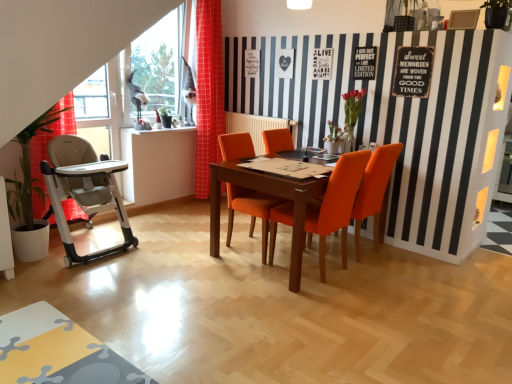
Describe the element at coordinates (52, 136) in the screenshot. I see `green leafy plant at left` at that location.

What is the approximate width of transparent glass window at upper left?

The width of transparent glass window at upper left is 8.88 inches.

How much space does orange fabric chair at center, which ranks as the first chair in right-to-left order, occupy vertically?

orange fabric chair at center, which ranks as the first chair in right-to-left order, is 38.79 inches tall.

What is the approximate width of orange fabric chair at center, which ranks as the 2th chair in right-to-left order?

orange fabric chair at center, which ranks as the 2th chair in right-to-left order, is 61.45 centimeters in width.

Where is `orange fabric chair at center, the 3th chair positioned from the right`? The width and height of the screenshot is (512, 384). orange fabric chair at center, the 3th chair positioned from the right is located at coordinates (251, 210).

The width and height of the screenshot is (512, 384). In order to click on green leafy plant at left in this screenshot , I will do `click(52, 136)`.

Can you confirm if red checkered curtain at left is positioned to the right of transparent glass window at upper left?

Yes, red checkered curtain at left is to the right of transparent glass window at upper left.

Considering the points (220, 105) and (139, 70), which point is in front, point (220, 105) or point (139, 70)?

The point (139, 70) is in front.

Which of these two, red checkered curtain at left or transparent glass window at upper left, is wider?

red checkered curtain at left.

From the image's perspective, is transparent glass window at upper left positioned above or below orange fabric chair at center, the 3th chair positioned from the right?

From the image's perspective, transparent glass window at upper left appears above orange fabric chair at center, the 3th chair positioned from the right.

Does transparent glass window at upper left have a greater width compared to orange fabric chair at center, the first chair in the left-to-right sequence?

No.

Where is `chair that is the 1st object located below the transparent glass window at upper left (from the image's perspective)`? This screenshot has width=512, height=384. chair that is the 1st object located below the transparent glass window at upper left (from the image's perspective) is located at coordinates (251, 210).

Can you confirm if transparent glass window at upper left is bigger than orange fabric chair at center, the 3th chair positioned from the right?

Actually, transparent glass window at upper left might be smaller than orange fabric chair at center, the 3th chair positioned from the right.

Measure the distance from red checkered curtain at left to orange fabric chair at center, which ranks as the 2th chair in right-to-left order.

6.10 feet.

Based on the photo, is red checkered curtain at left bigger than orange fabric chair at center, which ranks as the 2th chair in right-to-left order?

Incorrect, red checkered curtain at left is not larger than orange fabric chair at center, which ranks as the 2th chair in right-to-left order.

Are red checkered curtain at left and orange fabric chair at center, which ranks as the 2th chair in right-to-left order, beside each other?

red checkered curtain at left is not next to orange fabric chair at center, which ranks as the 2th chair in right-to-left order, and they're not touching.

From the picture: From a real-world perspective, is red checkered curtain at left above or below orange fabric chair at center, the second chair viewed from the left?

From a real-world perspective, red checkered curtain at left is physically above orange fabric chair at center, the second chair viewed from the left.

Considering the sizes of objects orange fabric chair at center, the 3th chair positioned from the left, and red checkered curtain at left in the image provided, who is bigger, orange fabric chair at center, the 3th chair positioned from the left, or red checkered curtain at left?

orange fabric chair at center, the 3th chair positioned from the left, is bigger.

Is orange fabric chair at center, the 3th chair positioned from the left, located outside red checkered curtain at left?

Absolutely, orange fabric chair at center, the 3th chair positioned from the left, is external to red checkered curtain at left.

Considering the positions of objects orange fabric chair at center, which ranks as the first chair in right-to-left order, and red checkered curtain at left in the image provided, who is behind, orange fabric chair at center, which ranks as the first chair in right-to-left order, or red checkered curtain at left?

red checkered curtain at left is behind.

Is red checkered curtain at left far from green leafy plant at left?

Absolutely, red checkered curtain at left is distant from green leafy plant at left.

From the image's perspective, between red checkered curtain at left and green leafy plant at left, which one is located above?

red checkered curtain at left, from the image's perspective.

Which of these two, red checkered curtain at left or green leafy plant at left, stands taller?

red checkered curtain at left is taller.

At what (x,y) coordinates should I click in order to perform the action: click on curtain lying behind the green leafy plant at left. Please return your answer as a coordinate pair (x, y). The width and height of the screenshot is (512, 384). Looking at the image, I should click on (208, 92).

Find the location of a particular element. curtain above the orange fabric chair at center, which ranks as the first chair in right-to-left order (from a real-world perspective) is located at coordinates (208, 92).

From a real-world perspective, is red checkered curtain at left on top of orange fabric chair at center, the 3th chair positioned from the left?

Yes, from a real-world perspective, red checkered curtain at left is above orange fabric chair at center, the 3th chair positioned from the left.

How distant is red checkered curtain at left from orange fabric chair at center, the 3th chair positioned from the left?

2.02 meters.

From the image's perspective, is red checkered curtain at left over orange fabric chair at center, which ranks as the first chair in right-to-left order?

Yes.

Is red checkered curtain at left a part of green leafy plant at left?

No, green leafy plant at left does not contain red checkered curtain at left.

From the picture: Is green leafy plant at left shorter than red checkered curtain at left?

Yes.

Considering the relative sizes of green leafy plant at left and red checkered curtain at left in the image provided, is green leafy plant at left thinner than red checkered curtain at left?

No.

Looking at this image, could you tell me if green leafy plant at left is turned towards red checkered curtain at left?

No, green leafy plant at left is not turned towards red checkered curtain at left.

This screenshot has height=384, width=512. I want to click on window screen in front of the red checkered curtain at left, so click(x=158, y=62).

Where is `window screen above the orange fabric chair at center, the first chair in the left-to-right sequence (from the image's perspective)`? window screen above the orange fabric chair at center, the first chair in the left-to-right sequence (from the image's perspective) is located at coordinates (158, 62).

Considering their positions, is green leafy plant at left positioned further to orange fabric chair at center, which ranks as the 2th chair in right-to-left order, than orange fabric chair at center, the 3th chair positioned from the right?

Among the two, green leafy plant at left is located further to orange fabric chair at center, which ranks as the 2th chair in right-to-left order.

Based on their spatial positions, is transparent glass window at upper left or green leafy plant at left further from red checkered curtain at left?

green leafy plant at left lies further to red checkered curtain at left than the other object.

From the image, which object appears to be nearer to green leafy plant at left, orange fabric chair at center, which ranks as the first chair in right-to-left order, or orange fabric chair at center, the 3th chair positioned from the right?

orange fabric chair at center, the 3th chair positioned from the right.

When comparing their distances from green leafy plant at left, does red checkered curtain at left or orange fabric chair at center, the 3th chair positioned from the left, seem closer?

Based on the image, red checkered curtain at left appears to be nearer to green leafy plant at left.

Considering their positions, is green leafy plant at left positioned further to orange fabric chair at center, the 3th chair positioned from the left, than transparent glass window at upper left?

transparent glass window at upper left is positioned further to the anchor orange fabric chair at center, the 3th chair positioned from the left.

When comparing their distances from transparent glass window at upper left, does red checkered curtain at left or orange fabric chair at center, which ranks as the first chair in right-to-left order, seem further?

orange fabric chair at center, which ranks as the first chair in right-to-left order, is further to transparent glass window at upper left.

Based on their spatial positions, is transparent glass window at upper left or orange fabric chair at center, the second chair viewed from the left, closer to orange fabric chair at center, the first chair in the left-to-right sequence?

orange fabric chair at center, the second chair viewed from the left, is closer to orange fabric chair at center, the first chair in the left-to-right sequence.

Which object lies further to the anchor point red checkered curtain at left, orange fabric chair at center, the first chair in the left-to-right sequence, or green leafy plant at left?

green leafy plant at left lies further to red checkered curtain at left than the other object.

Find the location of `curtain between green leafy plant at left and orange fabric chair at center, the 3th chair positioned from the right`. curtain between green leafy plant at left and orange fabric chair at center, the 3th chair positioned from the right is located at coordinates (208, 92).

Image resolution: width=512 pixels, height=384 pixels. I want to click on window screen between green leafy plant at left and orange fabric chair at center, which ranks as the first chair in right-to-left order, in the horizontal direction, so click(x=158, y=62).

This screenshot has width=512, height=384. I want to click on chair between orange fabric chair at center, the 3th chair positioned from the right, and orange fabric chair at center, which ranks as the first chair in right-to-left order, so click(337, 204).

You are a GUI agent. You are given a task and a screenshot of the screen. Output one action in this format:
    pyautogui.click(x=<x>, y=<y>)
    Task: Click on the curtain between transparent glass window at upper left and orange fabric chair at center, the 3th chair positioned from the right, in the vertical direction
    The image size is (512, 384).
    Given the screenshot: What is the action you would take?
    pyautogui.click(x=208, y=92)